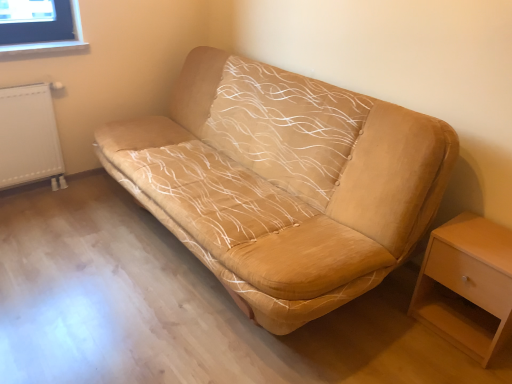
The width and height of the screenshot is (512, 384). Find the location of `vacant space situated on the left part of beige suede sofa at center`. vacant space situated on the left part of beige suede sofa at center is located at coordinates (75, 247).